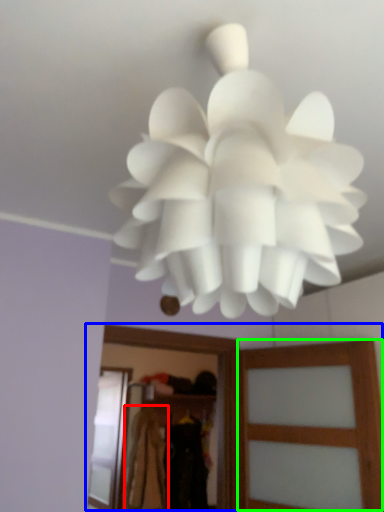
Question: Which object is positioned farthest from clothing (highlighted by a red box)? Select from clothing (highlighted by a blue box) and screen door (highlighted by a green box).

Choices:
 (A) clothing
 (B) screen door

Answer: (B)